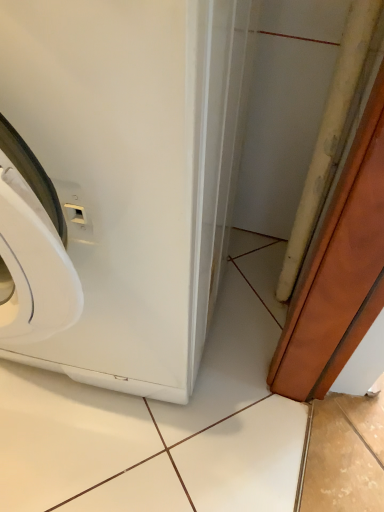
What do you see at coordinates (118, 184) in the screenshot? I see `white matte washing machine at lower left` at bounding box center [118, 184].

You are a GUI agent. You are given a task and a screenshot of the screen. Output one action in this format:
    pyautogui.click(x=<x>, y=<y>)
    Task: Click on the white matte washing machine at lower left
    
    Given the screenshot: What is the action you would take?
    pyautogui.click(x=118, y=184)

The width and height of the screenshot is (384, 512). Identify the location of white matte washing machine at lower left. (118, 184).